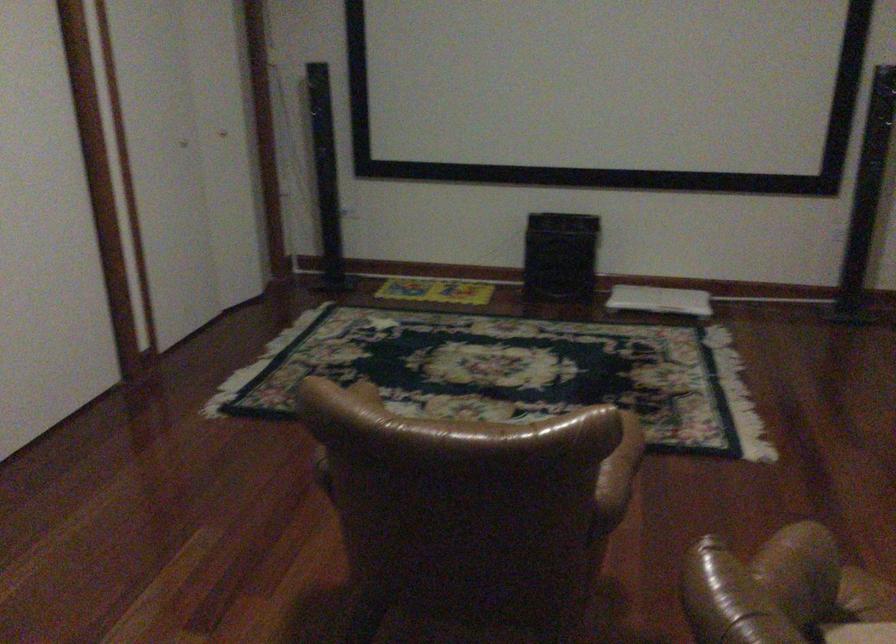
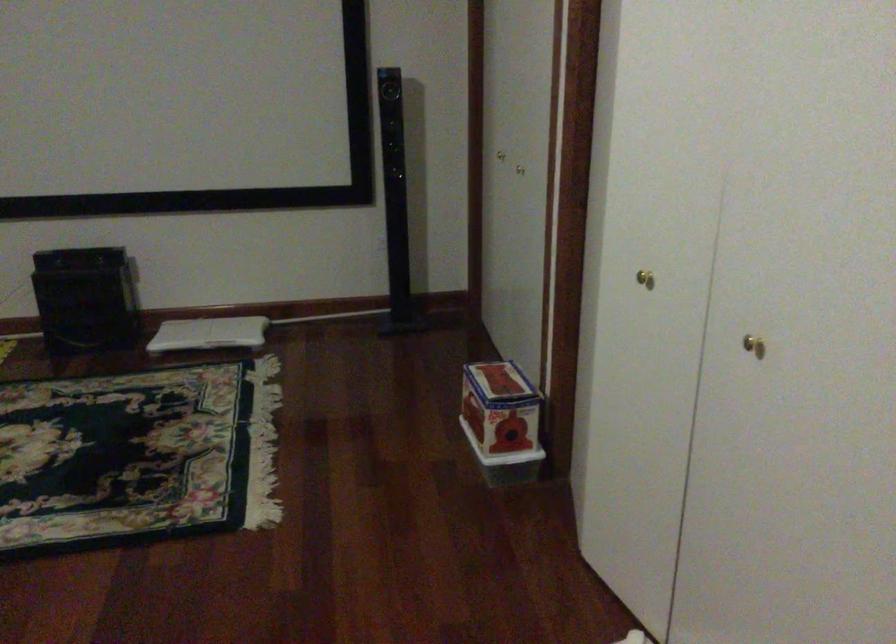
Question: The camera is either moving clockwise (left) or counter-clockwise (right) around the object. The first image is from the beginning of the video and the second image is from the end. Is the camera moving left or right when shooting the video?

Choices:
 (A) Left
 (B) Right

Answer: (A)